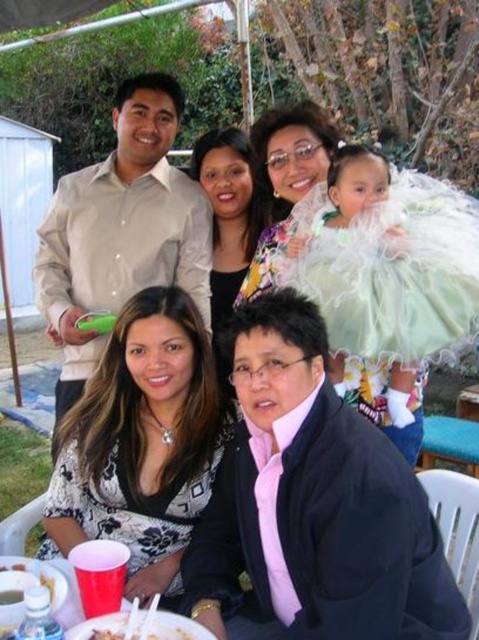
You are standing at the center of the image. Which direction should you move to get closer to the beige smooth shirt at upper left?

You should move to the upper left direction to get closer to the beige smooth shirt at upper left since its position is at point (122, 228).